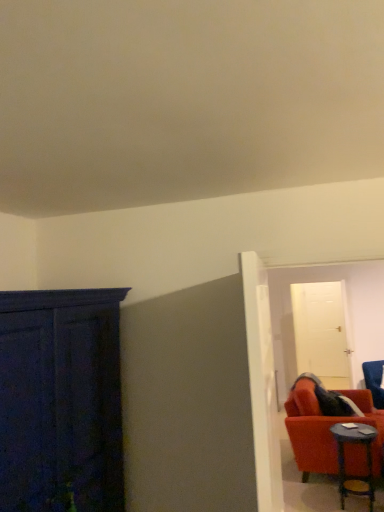
The height and width of the screenshot is (512, 384). In order to click on free space above wooden round table at lower right (from a real-world perspective) in this screenshot , I will do `click(352, 429)`.